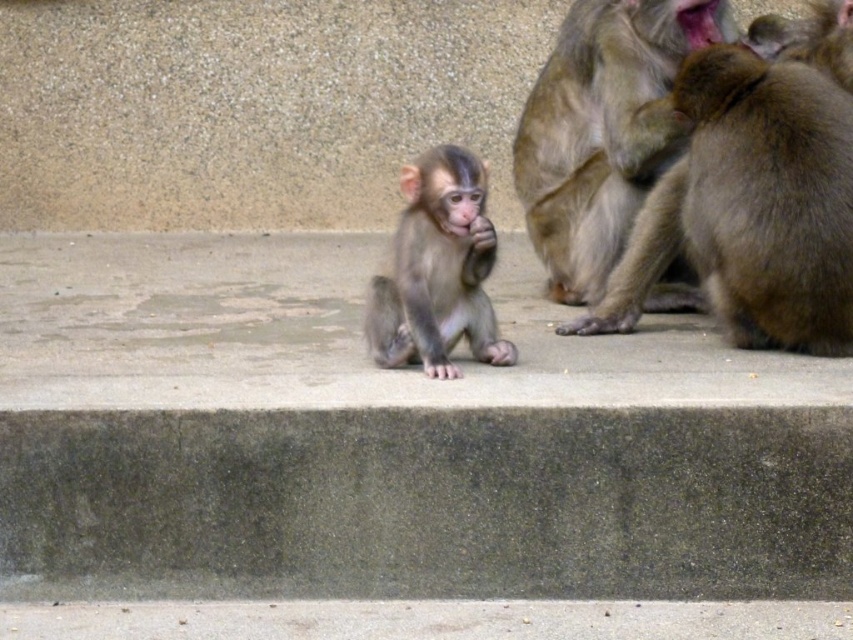
Is concrete ledge at center above brown furry monkey at right?

Incorrect, concrete ledge at center is not positioned above brown furry monkey at right.

Which is above, concrete ledge at center or brown furry monkey at right?

brown furry monkey at right

Is point (366, 465) in front of point (813, 109)?

Yes, it is in front of point (813, 109).

Identify the location of concrete ledge at center. pos(393,436).

Is point (647, 106) farther from viewer compared to point (824, 54)?

Yes, point (647, 106) is behind point (824, 54).

Consider the image. Is fuzzy brown monkey at center further to camera compared to brown furry monkey at upper right?

Yes, it is behind brown furry monkey at upper right.

Identify the location of fuzzy brown monkey at center. The image size is (853, 640). (602, 131).

The image size is (853, 640). What do you see at coordinates (393, 436) in the screenshot?
I see `concrete ledge at center` at bounding box center [393, 436].

Is point (666, 451) farther from camera compared to point (822, 56)?

No, it is in front of (822, 56).

This screenshot has width=853, height=640. What are the coordinates of `concrete ledge at center` in the screenshot? It's located at (393, 436).